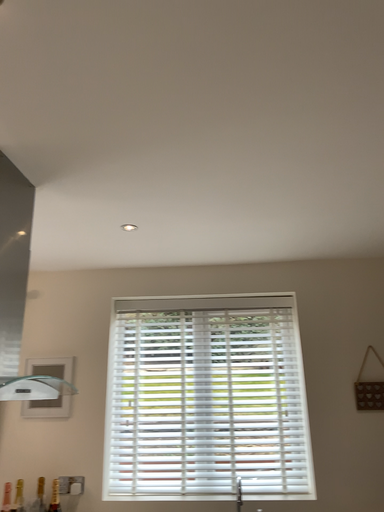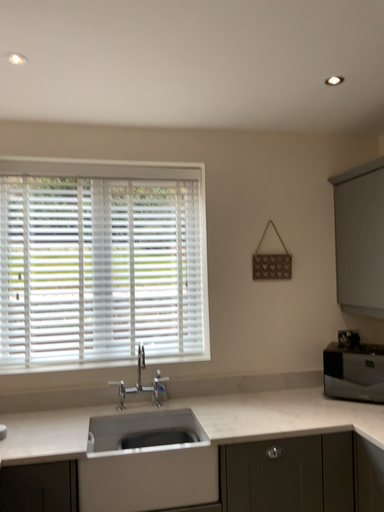
Question: Which way did the camera rotate in the video?

Choices:
 (A) rotated right
 (B) rotated left

Answer: (A)